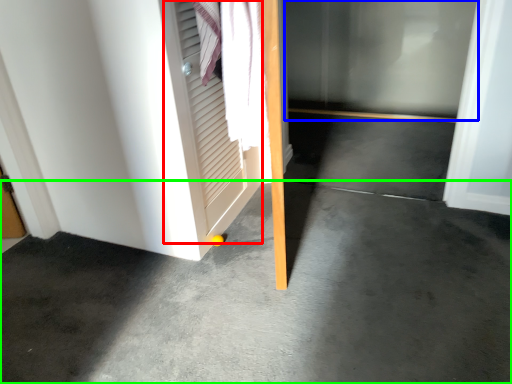
Question: Estimate the real-world distances between objects in this image. Which object is closer to screen door (highlighted by a red box), glass door (highlighted by a blue box) or concrete (highlighted by a green box)?

Choices:
 (A) glass door
 (B) concrete

Answer: (B)